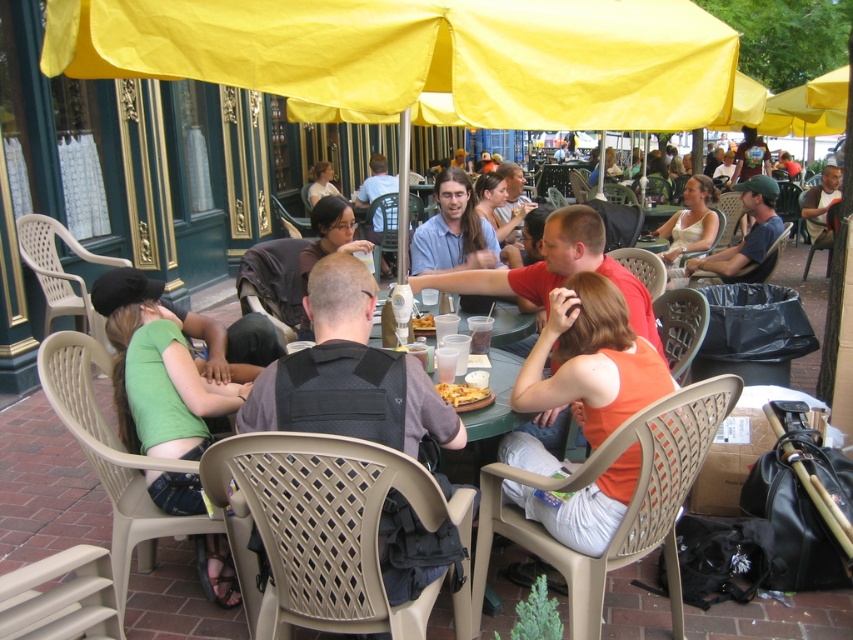
Question: Which of the following is the farthest from the observer?

Choices:
 (A) golden crispy pizza at center
 (B) green fabric shirt at lower left
 (C) green fabric shirt at center

Answer: (C)

Question: Which point is closer to the camera?

Choices:
 (A) (659, 227)
 (B) (485, 397)

Answer: (B)

Question: Does green fabric shirt at center have a smaller size compared to brown leather jacket at upper right?

Choices:
 (A) yes
 (B) no

Answer: (A)

Question: Which is nearer to the green fabric shirt at lower left?

Choices:
 (A) light brown hair at center
 (B) white tank top at center

Answer: (B)

Question: Is green fabric shirt at lower left closer to camera compared to light brown hair at center?

Choices:
 (A) no
 (B) yes

Answer: (B)

Question: Is green fabric shirt at center further to camera compared to white tank top at center?

Choices:
 (A) no
 (B) yes

Answer: (A)